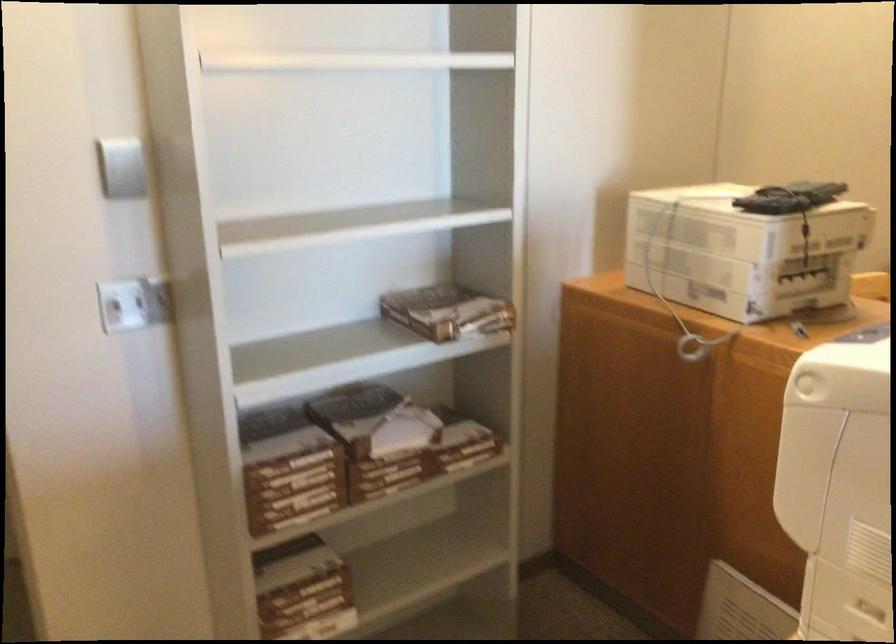
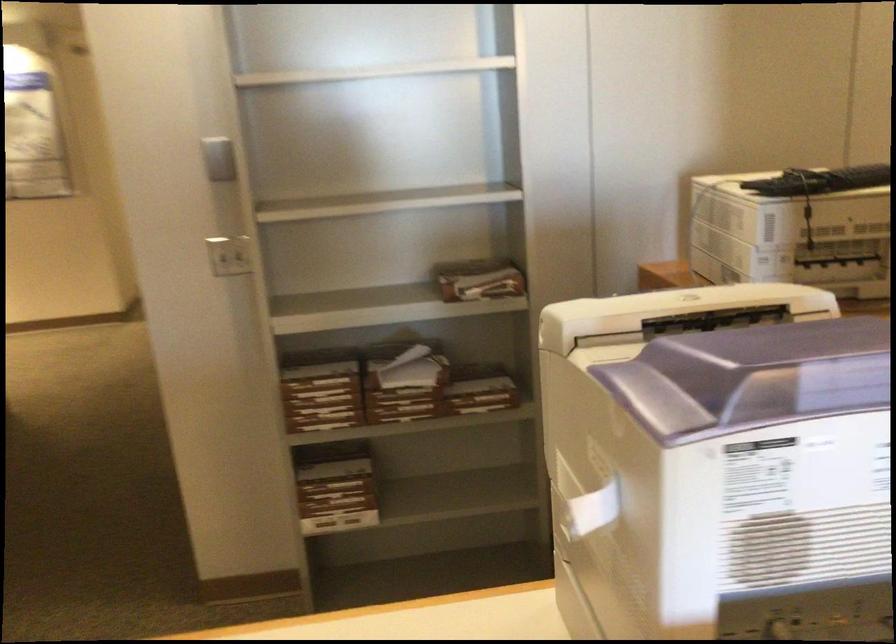
Question: In a continuous first-person perspective shot, in which direction is the camera moving?

Choices:
 (A) Left
 (B) Right
 (C) Forward
 (D) Backward

Answer: (B)